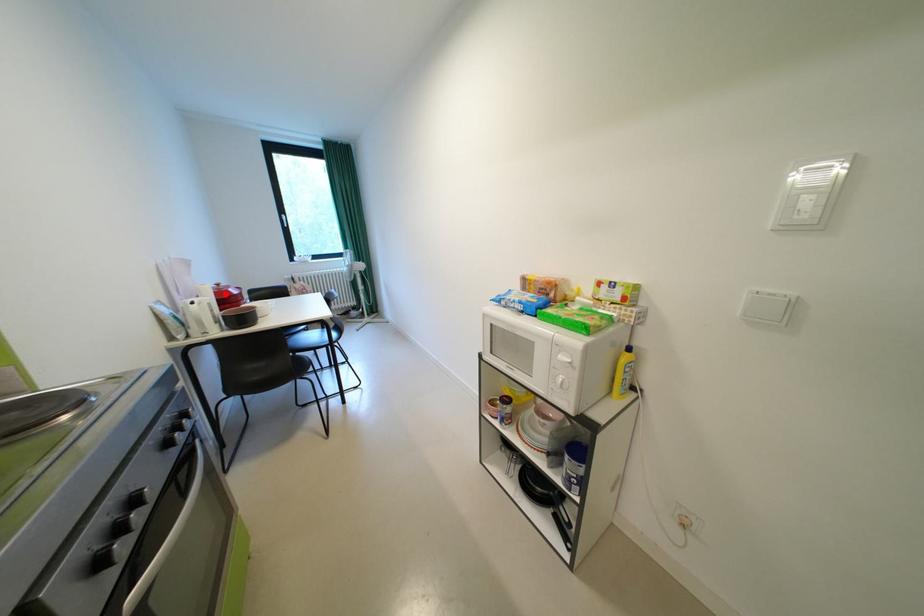
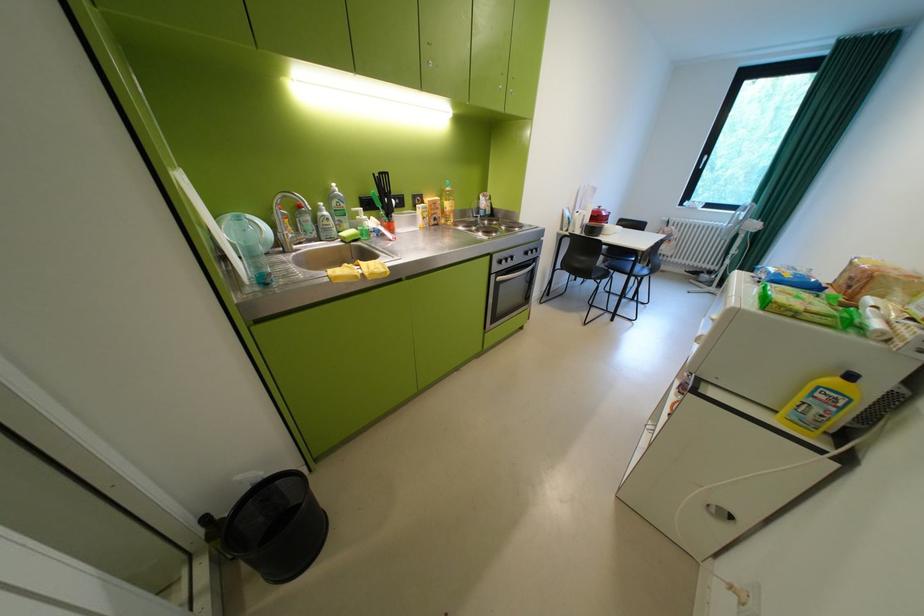
Locate, in the second image, the point that corresponds to the highlighted location in the first image.

(603, 213)